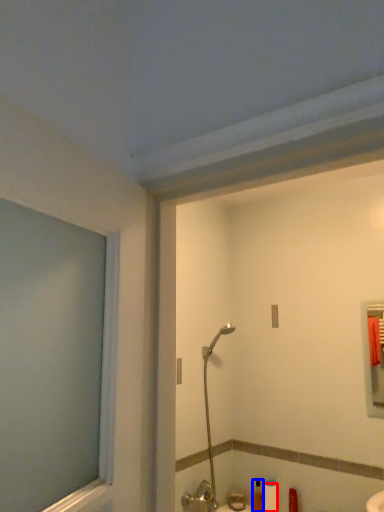
Question: Which of the following is the farthest to the observer, toilet paper (highlighted by a red box) or toiletry (highlighted by a blue box)?

Choices:
 (A) toilet paper
 (B) toiletry

Answer: (B)